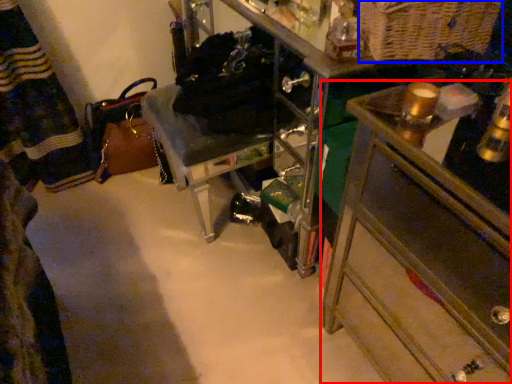
Question: Which of the following is the closest to the observer, chest of drawers (highlighted by a red box) or basket (highlighted by a blue box)?

Choices:
 (A) chest of drawers
 (B) basket

Answer: (A)